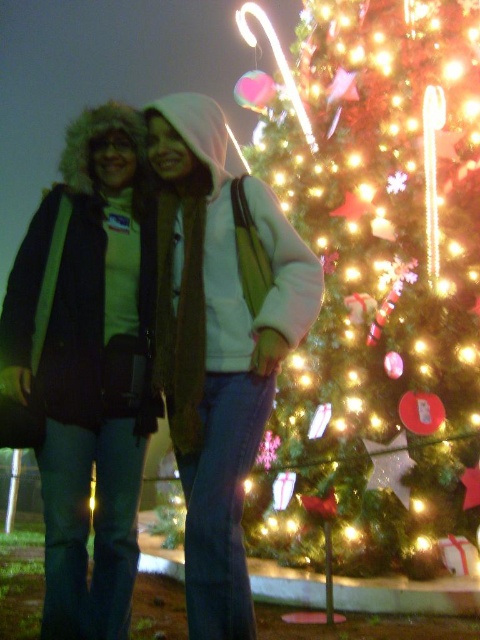
Who is positioned more to the right, illuminated green at center or matte black jacket at center?

Positioned to the right is illuminated green at center.

Does illuminated green at center have a greater width compared to matte black jacket at center?

Yes, illuminated green at center is wider than matte black jacket at center.

Is point (371, 289) positioned after point (128, 589)?

Yes, it is behind point (128, 589).

You are a GUI agent. You are given a task and a screenshot of the screen. Output one action in this format:
    pyautogui.click(x=<x>, y=<y>)
    Task: Click on the illuminated green at center
    The image size is (480, 640).
    Given the screenshot: What is the action you would take?
    pyautogui.click(x=384, y=268)

Is point (468, 445) closer to camera compared to point (134, 310)?

No, (468, 445) is further to viewer.

Describe the element at coordinates (384, 268) in the screenshot. I see `illuminated green at center` at that location.

The width and height of the screenshot is (480, 640). Identify the location of illuminated green at center. (384, 268).

In the scene shown: Between matte black jacket at center and brushed metal jacket at left, which one appears on the left side from the viewer's perspective?

From the viewer's perspective, brushed metal jacket at left appears more on the left side.

Can you confirm if matte black jacket at center is thinner than brushed metal jacket at left?

Incorrect, matte black jacket at center's width is not less than brushed metal jacket at left's.

Does point (214, 193) lie in front of point (105, 115)?

Yes, it is.

The width and height of the screenshot is (480, 640). I want to click on matte black jacket at center, so click(x=217, y=337).